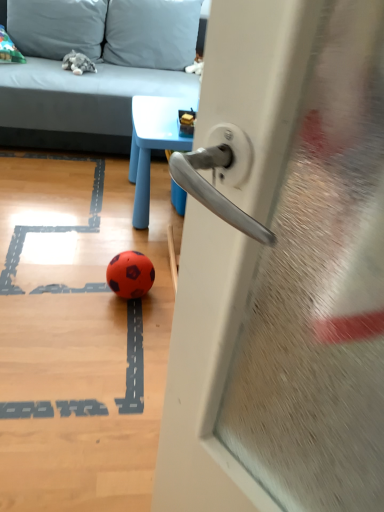
The height and width of the screenshot is (512, 384). Find the location of `vacant space to the right of gray plush toy at upper left`. vacant space to the right of gray plush toy at upper left is located at coordinates (104, 73).